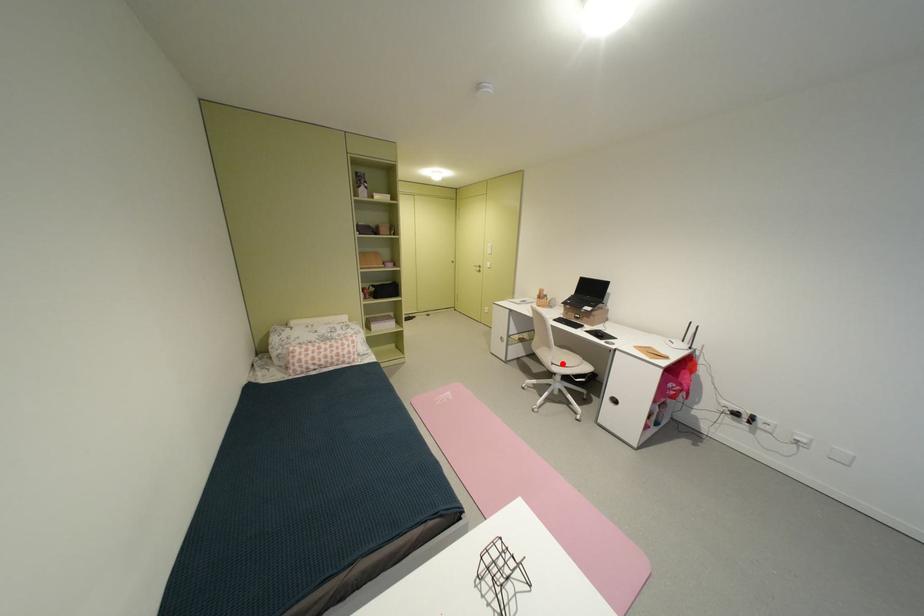
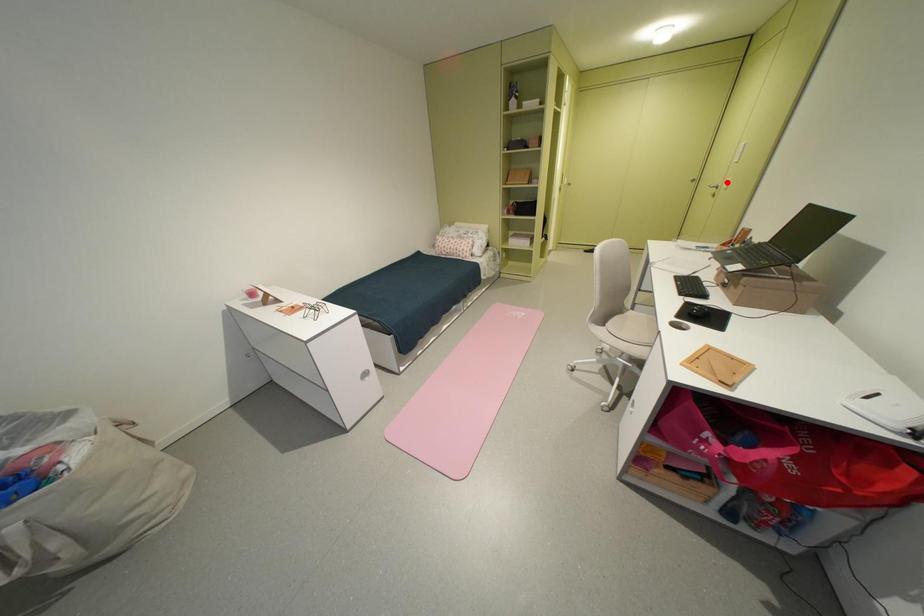
I am providing you with two images of the same scene from different viewpoints. A red point is marked on the first image and another point is marked on the second image. Do the highlighted points in image1 and image2 indicate the same real-world spot?

No